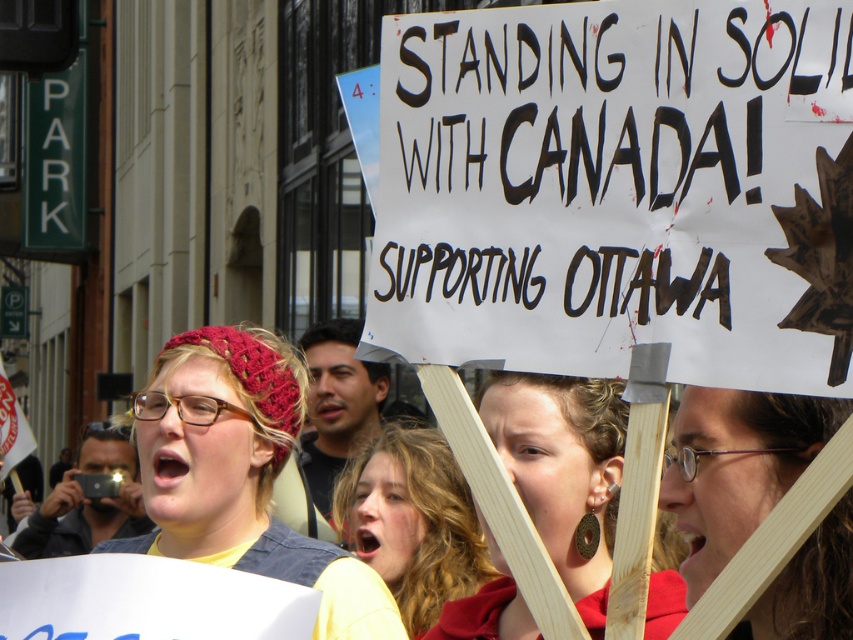
Consider the image. You are a photographer at the protest and want to capture the knitted red beanie at center and the wooden sign at center in the same frame. Since the camera can only focus on one object at a time, which object should you focus on to ensure the other remains in the background?

You should focus on the wooden sign at center because the knitted red beanie at center is below it, meaning the sign is closer to the camera and the beanie is further back, so focusing on the sign will keep the beanie in the background.

You are a photographer trying to capture the sign in the center of the image. You notice two points marked at coordinates point (369, 573) and point (836, 509). If you want to focus on the closer point to ensure the sign is sharp, which coordinate should you choose?

Point (369, 573) is closer to the viewer than point (836, 509), so you should focus on point (369, 573) to ensure the sign is sharp.